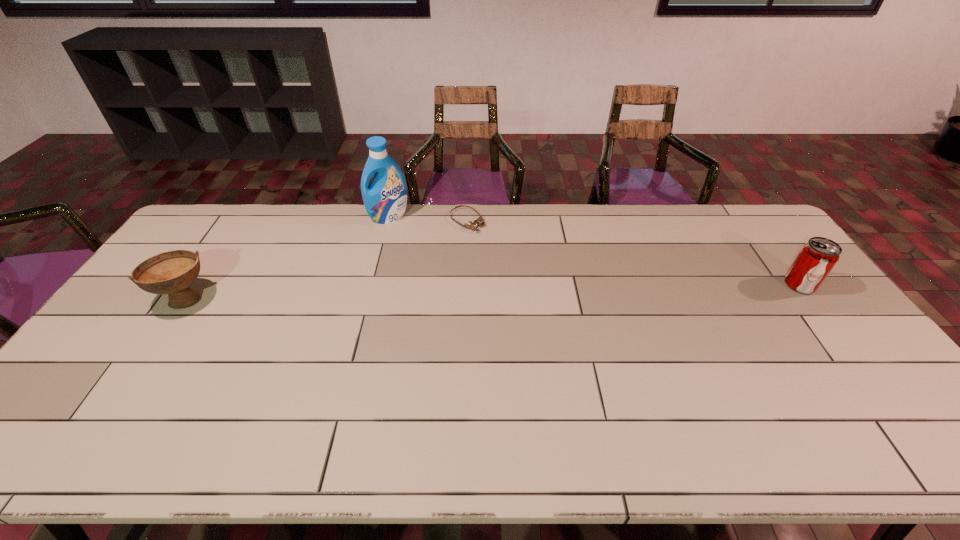
Where is `vacant space on the desktop that is between the leftmost object and the pop soda and is positioned on the front lenses and sides of the goggles`? vacant space on the desktop that is between the leftmost object and the pop soda and is positioned on the front lenses and sides of the goggles is located at coordinates (x=553, y=291).

Identify the location of vacant space on the desktop that is between the soup bowl and the pop soda and is positioned on the front-facing side of the second object from left to right. The image size is (960, 540). (431, 293).